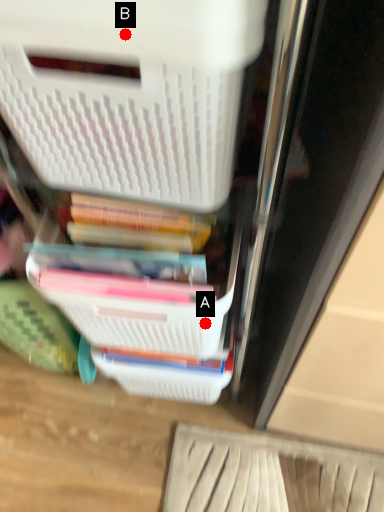
Question: Two points are circled on the image, labeled by A and B beside each circle. Which point is farther to the camera?

Choices:
 (A) A is further
 (B) B is further

Answer: (A)